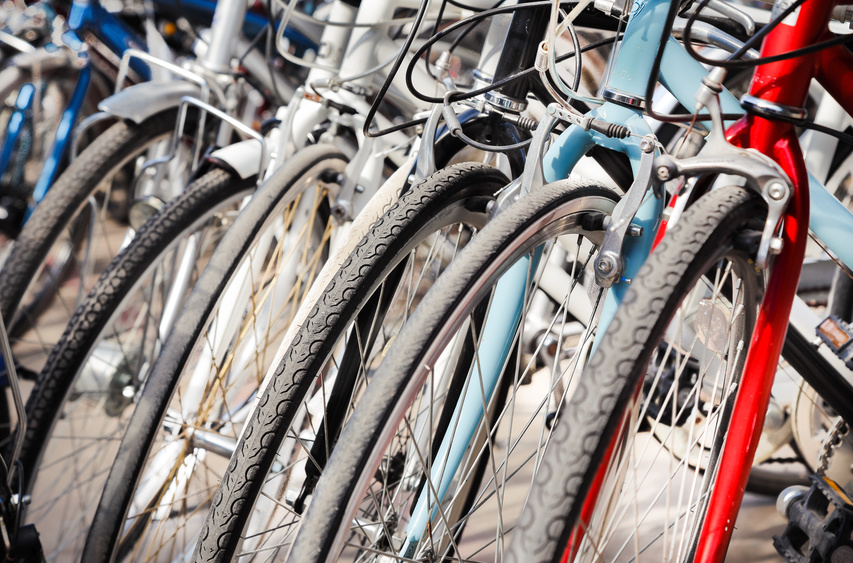
Find the location of a particular element. The height and width of the screenshot is (563, 853). frame is located at coordinates click(x=834, y=235), click(x=845, y=69), click(x=618, y=160), click(x=408, y=81), click(x=264, y=77), click(x=117, y=34), click(x=393, y=92).